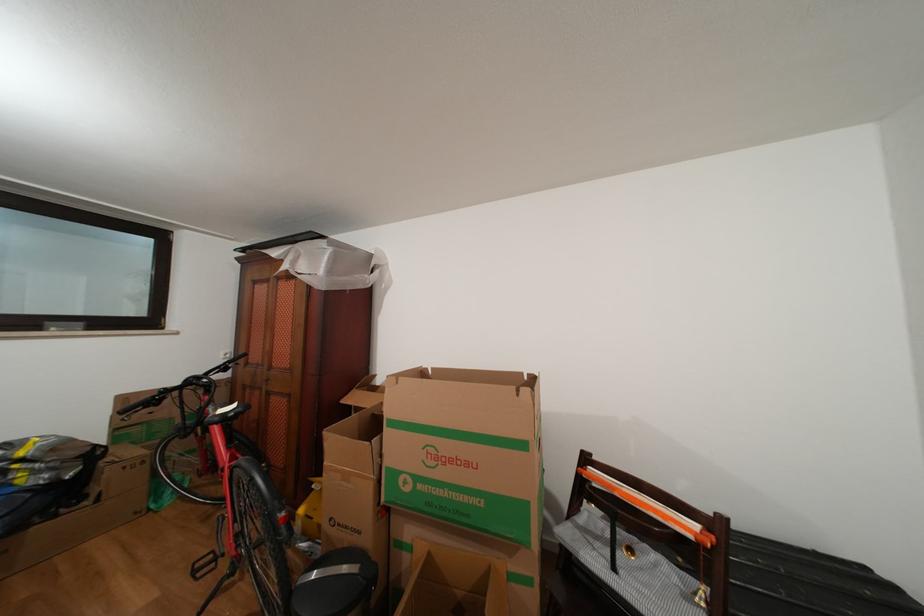
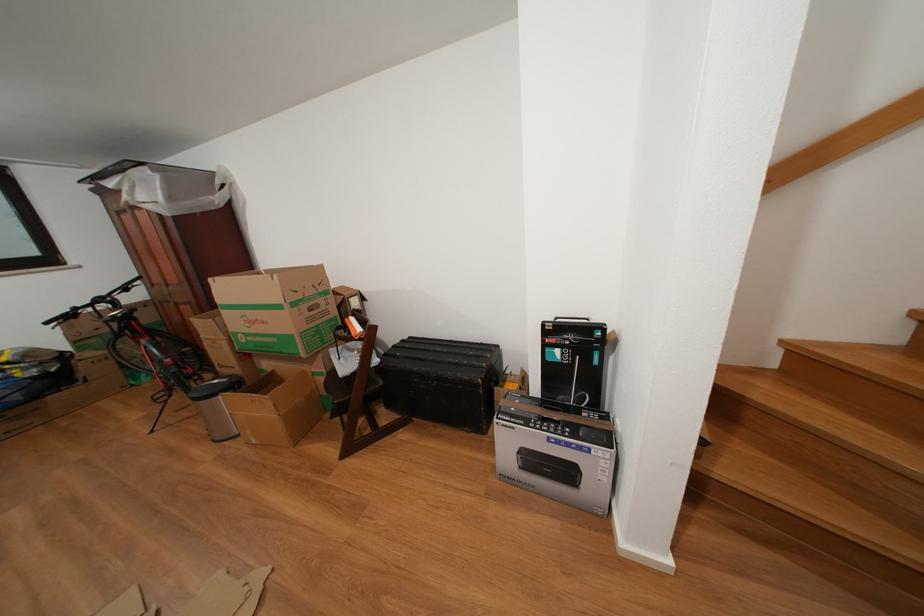
Where in the second image is the point corresponding to the point at 476,469 from the first image?

(272, 328)